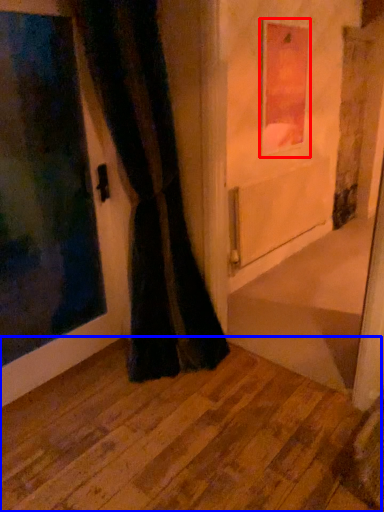
Question: Which object is closer to the camera taking this photo, picture frame (highlighted by a red box) or corridor (highlighted by a blue box)?

Choices:
 (A) picture frame
 (B) corridor

Answer: (B)